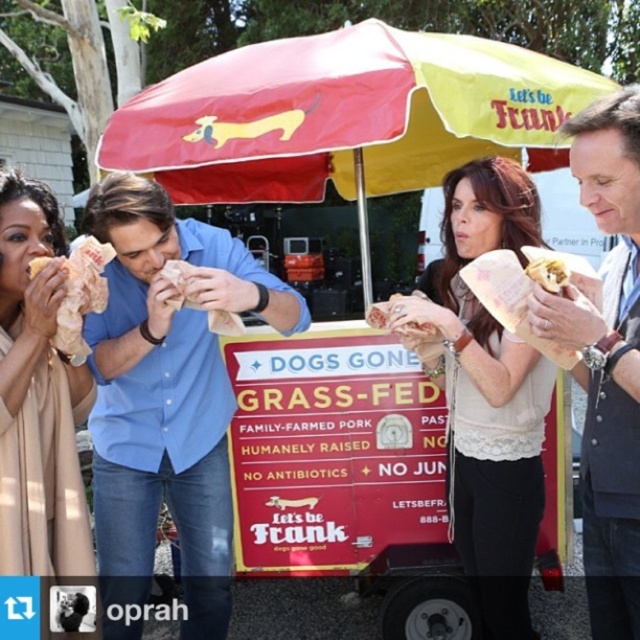
Question: Estimate the real-world distances between objects in this image. Which object is closer to the matte beige blouse at center?

Choices:
 (A) grass-fed cart at center
 (B) blue cotton shirt at center
 (C) matte beige dress at left

Answer: (A)

Question: Is matte beige blouse at center further to camera compared to grass-fed cart at center?

Choices:
 (A) no
 (B) yes

Answer: (B)

Question: Which of these objects is positioned farthest from the grass-fed cart at center?

Choices:
 (A) golden crispy chicken at left
 (B) grilled meat sandwich at center
 (C) matte beige blouse at center

Answer: (A)

Question: Which of these objects is positioned closest to the matte beige dress at left?

Choices:
 (A) golden crispy chicken at left
 (B) matte paper sandwich at center
 (C) grilled meat sandwich at center
 (D) blue cotton shirt at center

Answer: (A)

Question: Can you confirm if grass-fed cart at center is bigger than grilled meat sandwich at center?

Choices:
 (A) no
 (B) yes

Answer: (B)

Question: Is grass-fed cart at center wider than golden crispy chicken at left?

Choices:
 (A) no
 (B) yes

Answer: (B)